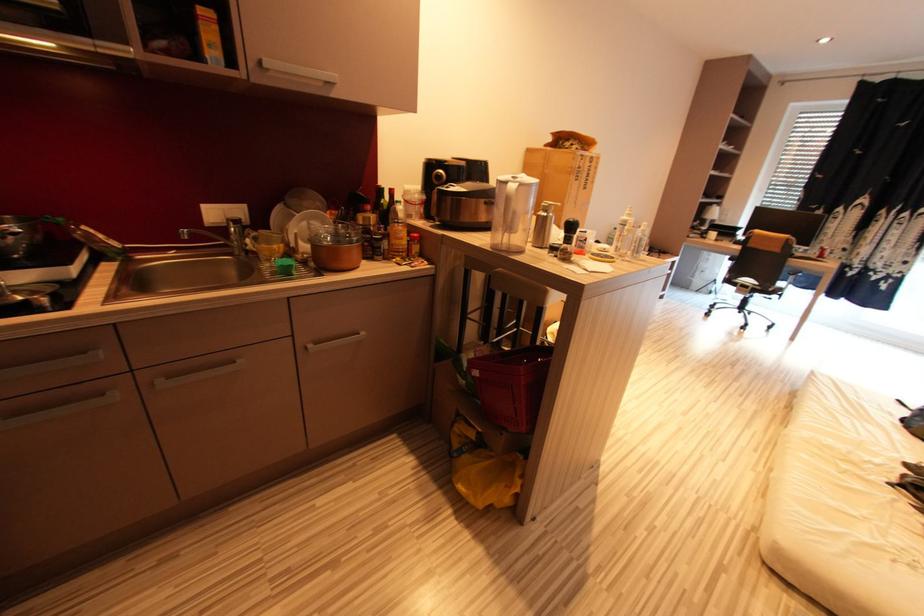
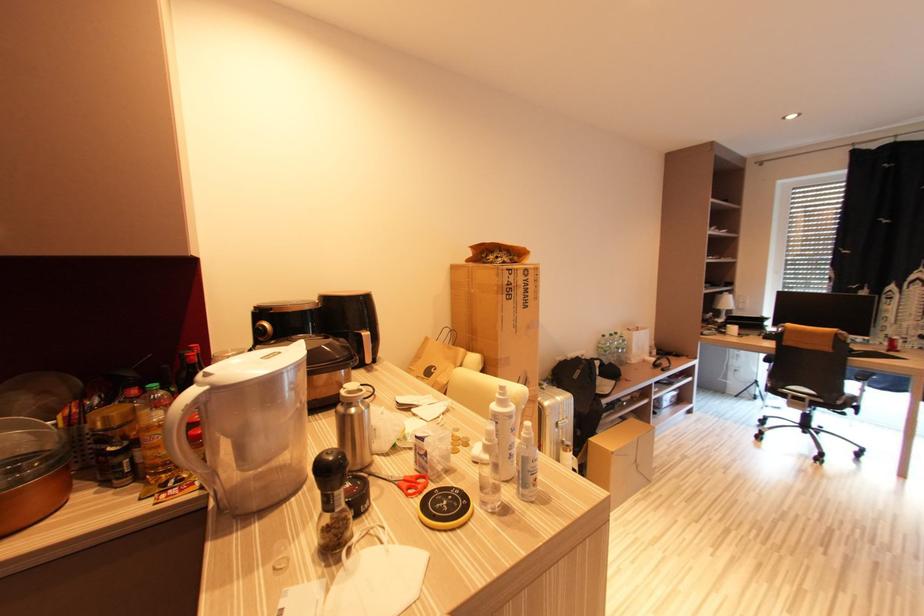
Question: The images are taken continuously from a first-person perspective. In which direction is your viewpoint rotating?

Choices:
 (A) Left
 (B) Right
 (C) Up
 (D) Down

Answer: (C)